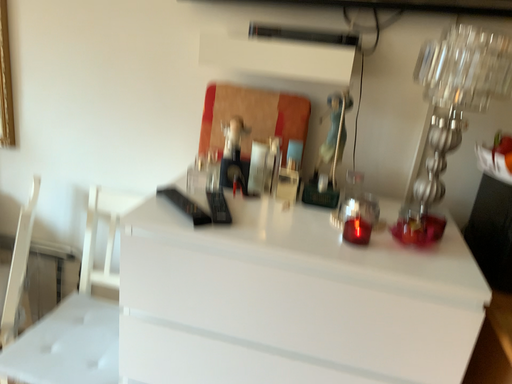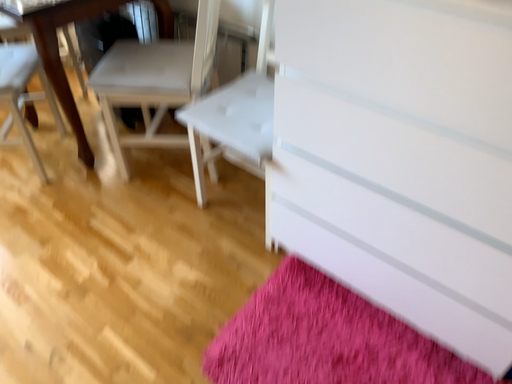
Question: How did the camera likely rotate when shooting the video?

Choices:
 (A) rotated left
 (B) rotated right

Answer: (A)